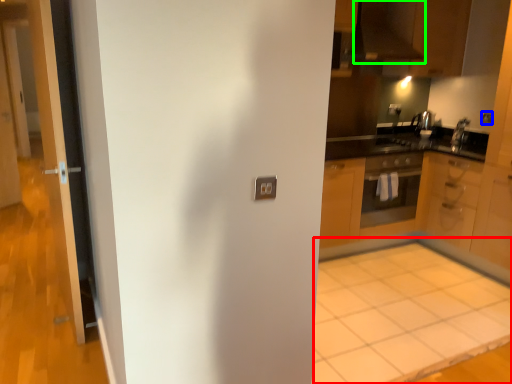
Question: Estimate the real-world distances between objects in this image. Which object is closer to plain (highlighted by a red box), electric outlet (highlighted by a blue box) or exhaust hood (highlighted by a green box)?

Choices:
 (A) electric outlet
 (B) exhaust hood

Answer: (A)